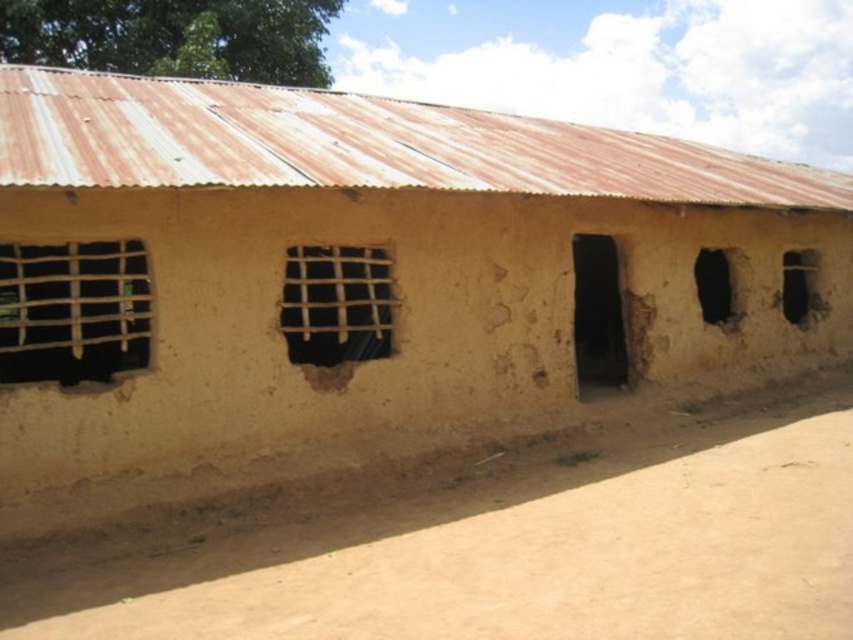
Question: Does brown mud hut at center come behind transparent plastic window at center?

Choices:
 (A) no
 (B) yes

Answer: (A)

Question: Estimate the real-world distances between objects in this image. Which object is farther from the brown mud hut at center?

Choices:
 (A) wooden lattice window at left
 (B) brown rough mud at center
 (C) black matte door at center

Answer: (B)

Question: Which point is closer to the camera?

Choices:
 (A) transparent plastic window at center
 (B) wooden lattice window at center
 (C) wooden lattice window at left

Answer: (C)

Question: Which point is closer to the camera?

Choices:
 (A) (553, 262)
 (B) (798, 316)
 (C) (328, 326)

Answer: (C)

Question: Is wooden lattice window at left positioned behind transparent plastic window at center right?

Choices:
 (A) no
 (B) yes

Answer: (A)

Question: Is brown mud hut at center in front of transparent plastic window at center right?

Choices:
 (A) yes
 (B) no

Answer: (A)